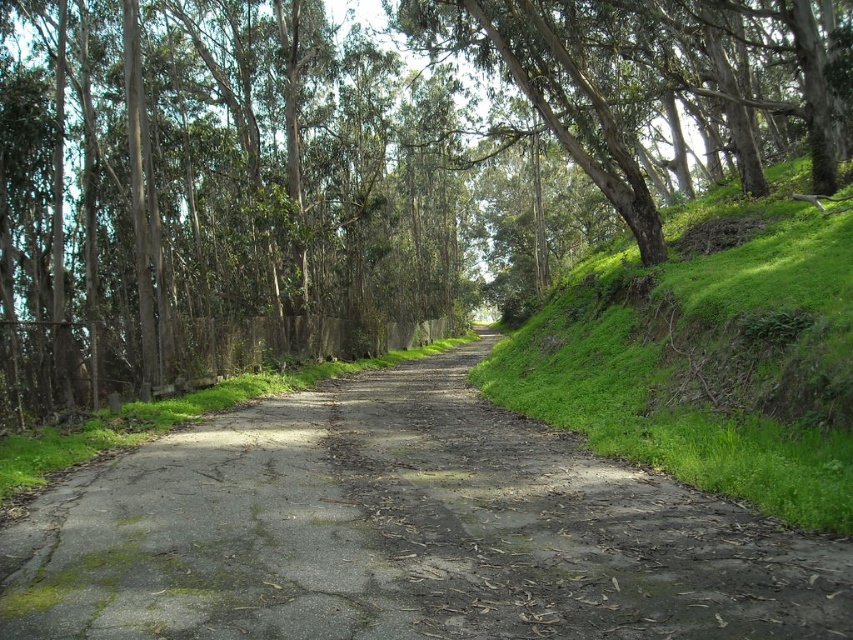
Question: Based on their relative distances, which object is nearer to the green grassy hillside at right?

Choices:
 (A) green leafy tree at center
 (B) dull gray asphalt at center

Answer: (B)

Question: Considering the relative positions of dull gray asphalt at center and green grassy hillside at right in the image provided, where is dull gray asphalt at center located with respect to green grassy hillside at right?

Choices:
 (A) left
 (B) right

Answer: (A)

Question: Does green leafy tree at center have a greater width compared to dull gray asphalt at center?

Choices:
 (A) yes
 (B) no

Answer: (A)

Question: Which point is farther to the camera?

Choices:
 (A) (140, 257)
 (B) (281, 449)

Answer: (A)

Question: Does green leafy tree at center appear over dull gray asphalt at center?

Choices:
 (A) yes
 (B) no

Answer: (A)

Question: Which of the following is the farthest from the observer?

Choices:
 (A) (181, 122)
 (B) (466, 346)

Answer: (B)